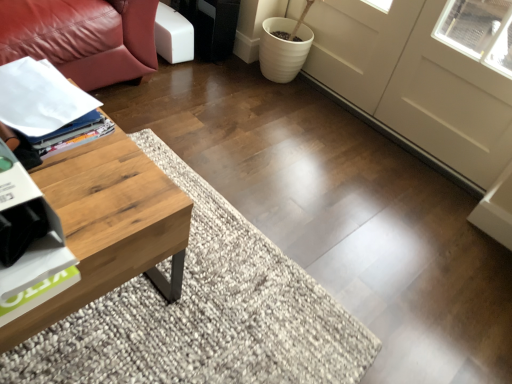
What are the coordinates of `vacant space underneath white matte screen door at center (from a real-world perspective)` in the screenshot? It's located at (332, 98).